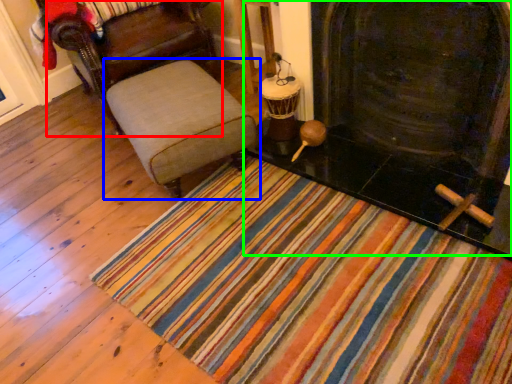
Question: Considering the real-world distances, which object is farthest from chair (highlighted by a red box)? furniture (highlighted by a blue box) or fireplace (highlighted by a green box)?

Choices:
 (A) furniture
 (B) fireplace

Answer: (B)